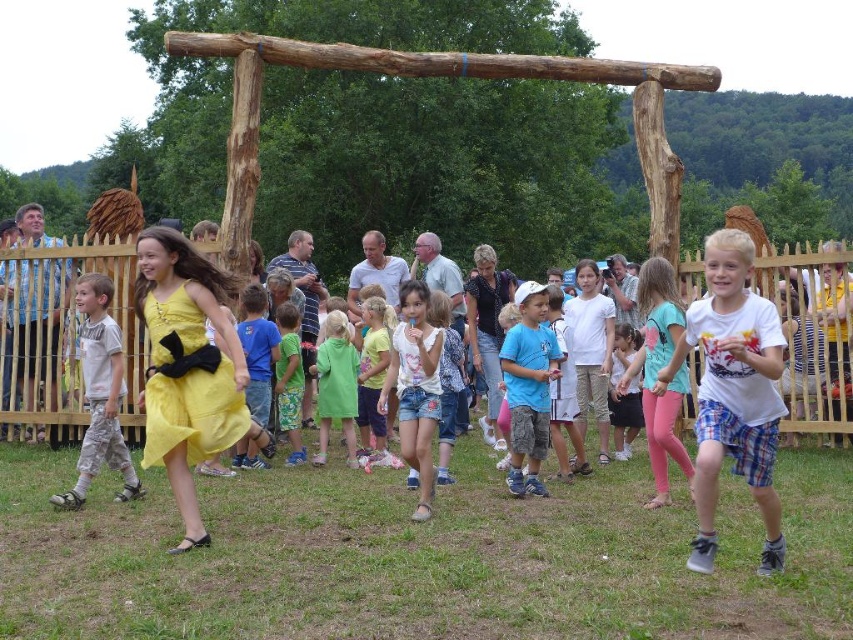
Question: Which object appears closest to the camera in this image?

Choices:
 (A) camouflage-patterned shorts at left
 (B) light green fabric dress at center
 (C) green matte dress at center

Answer: (A)

Question: Among these points, which one is nearest to the camera?

Choices:
 (A) (415, 477)
 (B) (113, 362)

Answer: (B)

Question: Observing the image, what is the correct spatial positioning of blue cotton shirt at center in reference to green matte dress at center?

Choices:
 (A) above
 (B) below

Answer: (A)

Question: Can you confirm if blue plaid shirt at left is positioned to the right of light green fabric dress at center?

Choices:
 (A) no
 (B) yes

Answer: (A)

Question: Is the position of blue cotton shirt at center more distant than that of light green fabric dress at center?

Choices:
 (A) yes
 (B) no

Answer: (B)

Question: Which point is closer to the camera?

Choices:
 (A) (708, 298)
 (B) (532, 426)

Answer: (A)